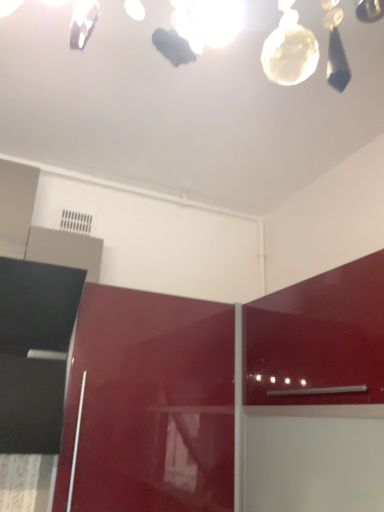
Describe the element at coordinates (150, 404) in the screenshot. I see `glossy red cabinet at center` at that location.

Find the location of a particular element. Image resolution: width=384 pixels, height=512 pixels. glossy red cabinet at center is located at coordinates (150, 404).

In order to click on glossy red cabinet at center in this screenshot , I will do `click(150, 404)`.